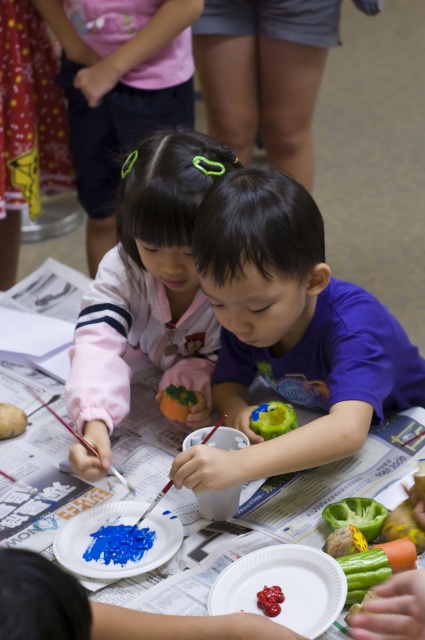
In the scene shown: You are a teacher observing the painting activity. You need to place a sticker on the object that is wider between the purple matte shirt at center and the matte white paper plate at lower center. Which object should you choose?

The purple matte shirt at center is wider than the matte white paper plate at lower center, so you should place the sticker on the purple matte shirt at center.

You are standing in front of the painting scene. The coordinates point to an object in the image. Which object is located at the coordinates point (289, 332)?

The point (289, 332) corresponds to the purple matte shirt at center.

You are standing in front of the scene and want to know how far you are from the point labeled as point (240,340). Can you determine the distance?

The distance between you and the point labeled as point (240,340) is 1.29 meters.